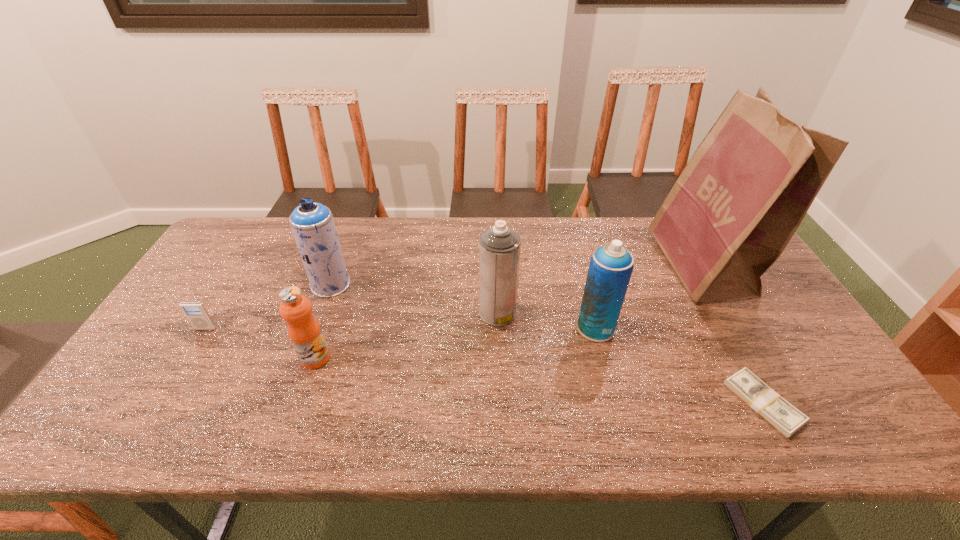
This screenshot has height=540, width=960. I want to click on object present at the near edge, so [786, 418].

Locate an element on the screen. Image resolution: width=960 pixels, height=540 pixels. object located in the left edge section of the desktop is located at coordinates (196, 313).

The image size is (960, 540). In order to click on grocery bag that is at the right edge in this screenshot , I will do `click(746, 189)`.

Identify the location of dollar positioned at the right edge. This screenshot has width=960, height=540. (786, 418).

The height and width of the screenshot is (540, 960). I want to click on object located in the far right corner section of the desktop, so click(746, 189).

Locate an element on the screen. This screenshot has width=960, height=540. object at the near right corner is located at coordinates (786, 418).

You are a GUI agent. You are given a task and a screenshot of the screen. Output one action in this format:
    pyautogui.click(x=<x>, y=<y>)
    Task: Click on the vacant area at the far edge of the desktop
    This screenshot has width=960, height=540.
    Given the screenshot: What is the action you would take?
    pyautogui.click(x=354, y=221)

Locate an element on the screen. This screenshot has width=960, height=540. free space at the near edge of the desktop is located at coordinates (628, 441).

You are a GUI agent. You are given a task and a screenshot of the screen. Output one action in this format:
    pyautogui.click(x=<x>, y=<y>)
    Task: Click on the vacant space at the left edge of the desktop
    
    Given the screenshot: What is the action you would take?
    pyautogui.click(x=211, y=284)

In the image, there is a desktop. What are the coordinates of `vacant space at the far left corner` in the screenshot? It's located at (273, 232).